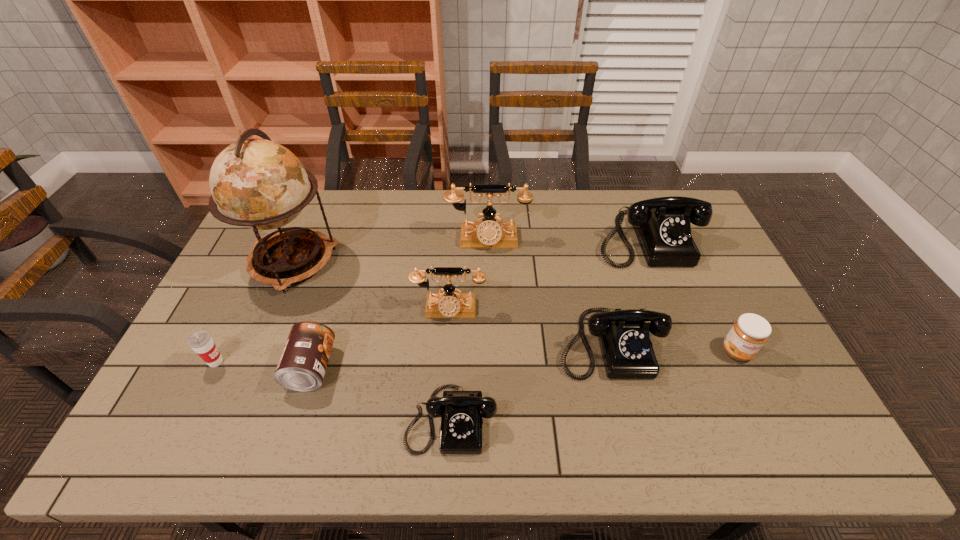
At what (x,y) coordinates should I click in order to perform the action: click on the shortest telephone. Please return your answer as a coordinate pair (x, y). Image resolution: width=960 pixels, height=540 pixels. Looking at the image, I should click on (461, 412).

The width and height of the screenshot is (960, 540). What are the coordinates of `the nearest telephone` in the screenshot? It's located at (461, 412).

At what (x,y) coordinates should I click in order to perform the action: click on vacant region located at the center of the globe. Please return your answer as a coordinate pair (x, y). The height and width of the screenshot is (540, 960). Looking at the image, I should click on (248, 369).

Locate an element on the screen. This screenshot has width=960, height=540. free location located 0.180m on the dial of the tallest telephone is located at coordinates (489, 293).

The height and width of the screenshot is (540, 960). Find the location of `free region located on the dial of the farthest black telephone`. free region located on the dial of the farthest black telephone is located at coordinates (692, 353).

Identify the location of vacant space located 0.340m on the dial of the smaller beige telephone. This screenshot has width=960, height=540. (442, 437).

At what (x,y) coordinates should I click in order to perform the action: click on free region located 0.170m on the dial of the fourth tallest telephone. Please return your answer as a coordinate pair (x, y). The width and height of the screenshot is (960, 540). Looking at the image, I should click on (635, 446).

The width and height of the screenshot is (960, 540). I want to click on vacant area located on the side of the cup with the logo, so click(x=297, y=362).

Locate an element on the screen. The height and width of the screenshot is (540, 960). free space located on the front label of the orange jam is located at coordinates (779, 438).

At what (x,y) coordinates should I click in order to perform the action: click on free space located on the front label of the can. Please return your answer as a coordinate pair (x, y). This screenshot has height=540, width=960. Looking at the image, I should click on (378, 368).